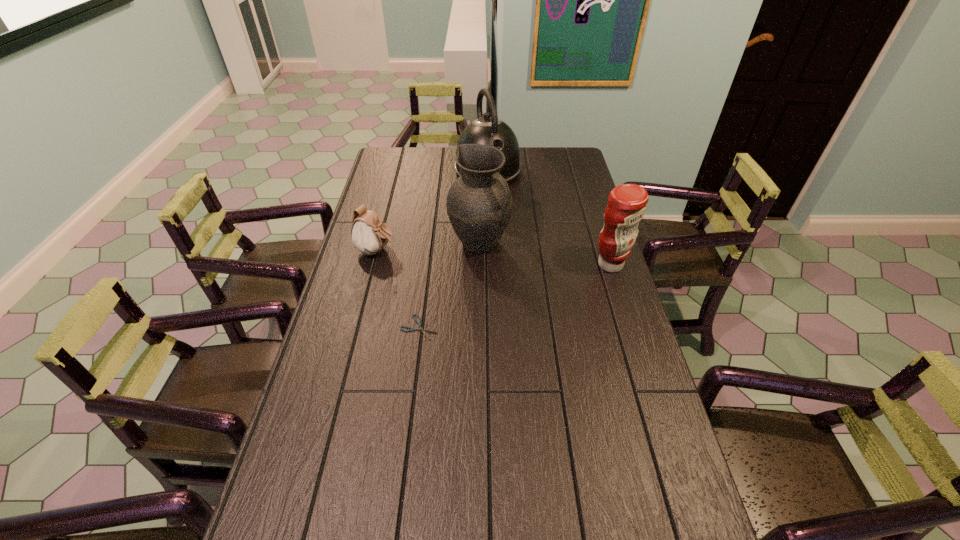
What are the coordinates of `object positioned at the left edge` in the screenshot? It's located at (369, 233).

Find the location of a particular element. Image resolution: width=960 pixels, height=540 pixels. object present at the right edge is located at coordinates (626, 206).

Where is `vacant space at the far edge of the desktop`? The width and height of the screenshot is (960, 540). vacant space at the far edge of the desktop is located at coordinates click(425, 154).

At what (x,y) coordinates should I click in order to perform the action: click on vacant area at the left edge. Please return your answer as a coordinate pair (x, y). Looking at the image, I should click on (373, 303).

What are the coordinates of `free space at the right edge of the desktop` in the screenshot? It's located at (608, 431).

The height and width of the screenshot is (540, 960). Find the location of `vacant space at the far left corner`. vacant space at the far left corner is located at coordinates [x=413, y=174].

The width and height of the screenshot is (960, 540). Identify the location of free location at the far right corner of the desktop. (566, 154).

Image resolution: width=960 pixels, height=540 pixels. Identify the location of free space at the near right corner of the desktop. (659, 502).

At what (x,y) coordinates should I click in order to perform the action: click on unoccupied position between the rightmost object and the shears. Please return your answer as a coordinate pair (x, y). Image resolution: width=960 pixels, height=540 pixels. Looking at the image, I should click on (515, 296).

This screenshot has height=540, width=960. Identify the location of blank region between the pouch and the kettle. (432, 211).